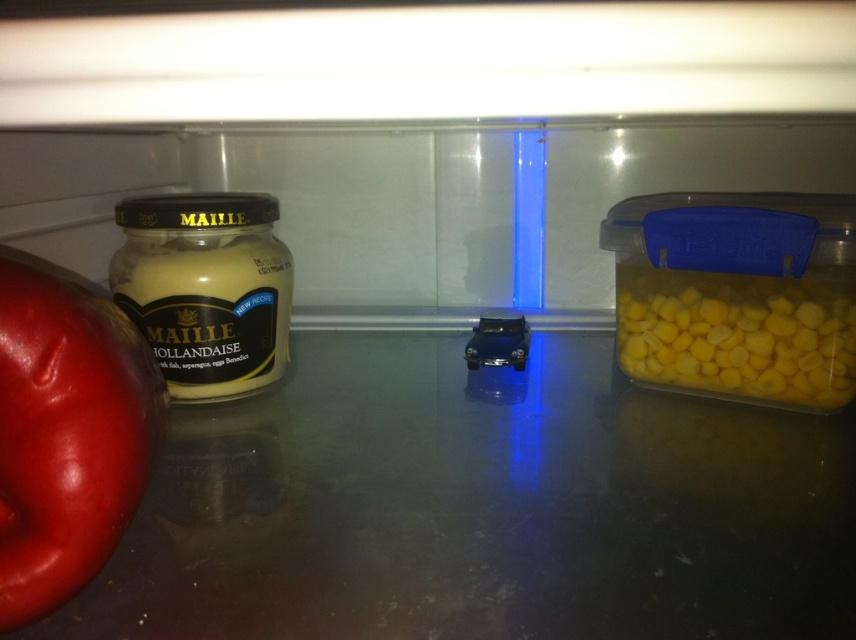
Is shiny red apple at left to the right of matte yellow mustard at left from the viewer's perspective?

Correct, you'll find shiny red apple at left to the right of matte yellow mustard at left.

What do you see at coordinates (66, 432) in the screenshot? I see `shiny red apple at left` at bounding box center [66, 432].

What do you see at coordinates (66, 432) in the screenshot? The image size is (856, 640). I see `shiny red apple at left` at bounding box center [66, 432].

Locate an element on the screen. The width and height of the screenshot is (856, 640). shiny red apple at left is located at coordinates (66, 432).

Between point (34, 532) and point (779, 332), which one is positioned behind?

Point (779, 332)

Measure the distance between shiny red apple at left and yellow matte corn at right.

The distance of shiny red apple at left from yellow matte corn at right is 50.77 centimeters.

Find the location of `shiny red apple at left`. shiny red apple at left is located at coordinates (66, 432).

At what (x,y) coordinates should I click in order to perform the action: click on shiny red apple at left. Please return your answer as a coordinate pair (x, y). Image resolution: width=856 pixels, height=640 pixels. Looking at the image, I should click on (66, 432).

Can you confirm if shiny red apple at left is positioned below metallic blue toy car at center?

A: Indeed, shiny red apple at left is positioned under metallic blue toy car at center.

Which is behind, point (22, 550) or point (489, 317)?

The point (489, 317) is behind.

Locate an element on the screen. The height and width of the screenshot is (640, 856). shiny red apple at left is located at coordinates (66, 432).